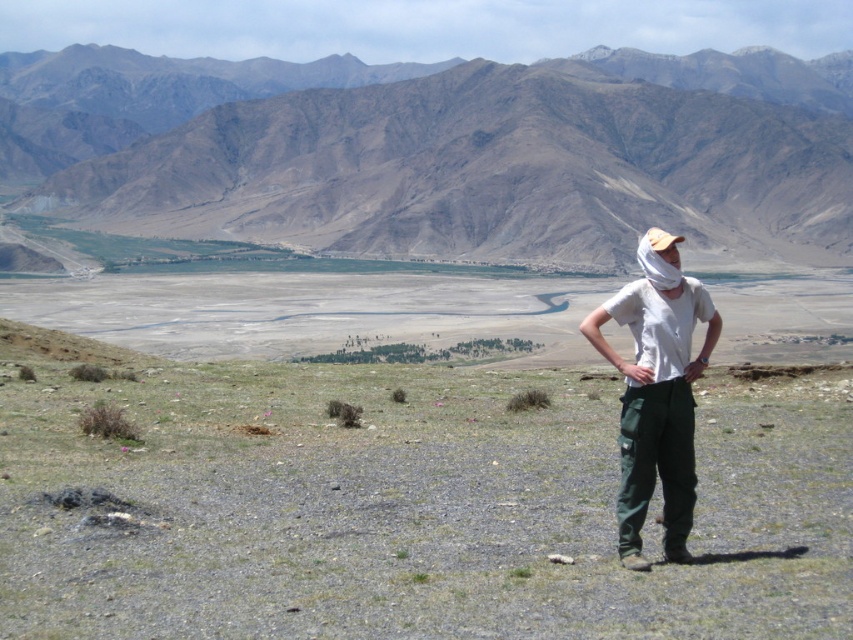
Is point (154, 148) in front of point (677, 259)?

No.

At what (x,y) coordinates should I click in order to perform the action: click on brown rocky mountain at upper center. Please return your answer as a coordinate pair (x, y). Looking at the image, I should click on (498, 163).